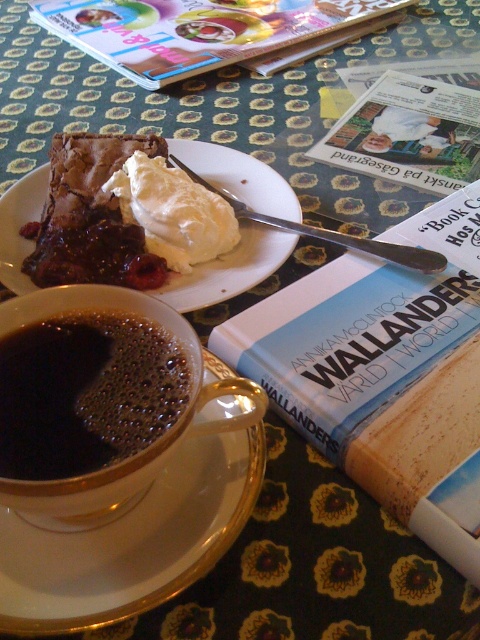
Question: Can you confirm if white porcelain saucer at center is bigger than white fluffy whipped cream at center?

Choices:
 (A) yes
 (B) no

Answer: (A)

Question: Which point is closer to the camera taking this photo?

Choices:
 (A) (355, 387)
 (B) (417, 170)
 (C) (51, 552)

Answer: (C)

Question: Is white porcelain saucer at lower left to the right of black glossy cup at lower left from the viewer's perspective?

Choices:
 (A) no
 (B) yes

Answer: (B)

Question: Based on their relative distances, which object is nearer to the black glossy mug at upper left?

Choices:
 (A) hardcover book at center
 (B) white fluffy whipped cream at center

Answer: (A)

Question: Does hardcover book at center appear on the right side of black glossy cup at lower left?

Choices:
 (A) no
 (B) yes

Answer: (B)

Question: Which object is the farthest from the black glossy mug at upper left?

Choices:
 (A) hardcover book at center
 (B) matte plastic magazine at upper center

Answer: (B)